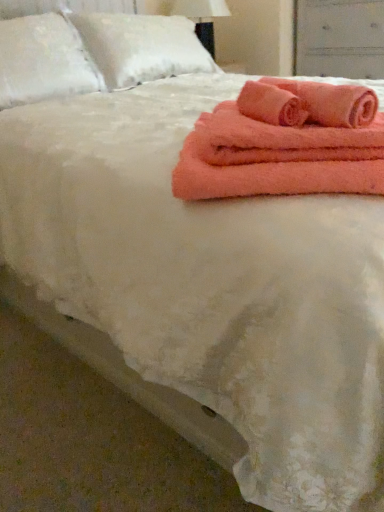
Question: From the image's perspective, is white fluffy pillow at upper left, the 1th pillow viewed from the left, above white fluffy pillow at upper left, which is the 1th pillow in right-to-left order?

Choices:
 (A) yes
 (B) no

Answer: (B)

Question: Considering the relative sizes of white fluffy pillow at upper left, placed as the 2th pillow when sorted from right to left, and white fluffy pillow at upper left, placed as the second pillow when sorted from left to right, in the image provided, is white fluffy pillow at upper left, placed as the 2th pillow when sorted from right to left, wider than white fluffy pillow at upper left, placed as the second pillow when sorted from left to right,?

Choices:
 (A) no
 (B) yes

Answer: (A)

Question: From a real-world perspective, is white fluffy pillow at upper left, the 1th pillow viewed from the left, located beneath white fluffy pillow at upper left, which is the 1th pillow in right-to-left order?

Choices:
 (A) yes
 (B) no

Answer: (B)

Question: Is white fluffy pillow at upper left, placed as the 2th pillow when sorted from right to left, not near white fluffy pillow at upper left, which is the 1th pillow in right-to-left order?

Choices:
 (A) yes
 (B) no

Answer: (B)

Question: Considering the relative positions of white fluffy pillow at upper left, placed as the 2th pillow when sorted from right to left, and white fluffy pillow at upper left, placed as the second pillow when sorted from left to right, in the image provided, is white fluffy pillow at upper left, placed as the 2th pillow when sorted from right to left, in front of white fluffy pillow at upper left, placed as the second pillow when sorted from left to right,?

Choices:
 (A) no
 (B) yes

Answer: (B)

Question: Considering the positions of white fabric lampshade at upper center and matte white drawer at upper right in the image, is white fabric lampshade at upper center taller or shorter than matte white drawer at upper right?

Choices:
 (A) short
 (B) tall

Answer: (A)

Question: Based on their sizes in the image, would you say white fabric lampshade at upper center is bigger or smaller than matte white drawer at upper right?

Choices:
 (A) small
 (B) big

Answer: (A)

Question: In terms of width, does white fabric lampshade at upper center look wider or thinner when compared to matte white drawer at upper right?

Choices:
 (A) thin
 (B) wide

Answer: (A)

Question: Would you say white fabric lampshade at upper center is inside or outside matte white drawer at upper right?

Choices:
 (A) outside
 (B) inside

Answer: (A)

Question: Is matte white drawer at upper right in front of or behind coral plush bath towel at upper right in the image?

Choices:
 (A) behind
 (B) front

Answer: (A)

Question: From the image's perspective, is matte white drawer at upper right positioned above or below coral plush bath towel at upper right?

Choices:
 (A) below
 (B) above

Answer: (B)

Question: Considering the positions of matte white drawer at upper right and coral plush bath towel at upper right in the image, is matte white drawer at upper right wider or thinner than coral plush bath towel at upper right?

Choices:
 (A) wide
 (B) thin

Answer: (A)

Question: In terms of height, does matte white drawer at upper right look taller or shorter compared to coral plush bath towel at upper right?

Choices:
 (A) short
 (B) tall

Answer: (B)

Question: Is matte white drawer at upper right inside the boundaries of white fluffy pillow at upper left, placed as the 2th pillow when sorted from right to left, or outside?

Choices:
 (A) inside
 (B) outside

Answer: (B)

Question: Is point (347, 49) positioned closer to the camera than point (21, 72)?

Choices:
 (A) closer
 (B) farther

Answer: (B)